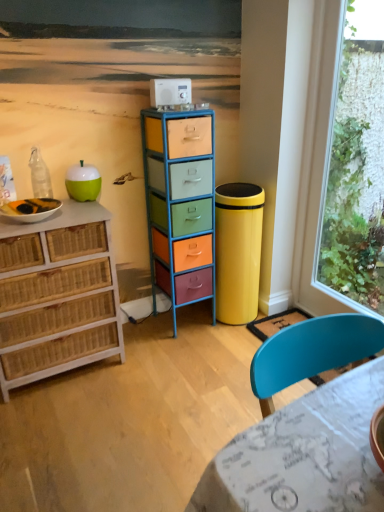
Find the location of a particular element. This screenshot has height=512, width=384. free location in front of green matte apple at left is located at coordinates pos(79,209).